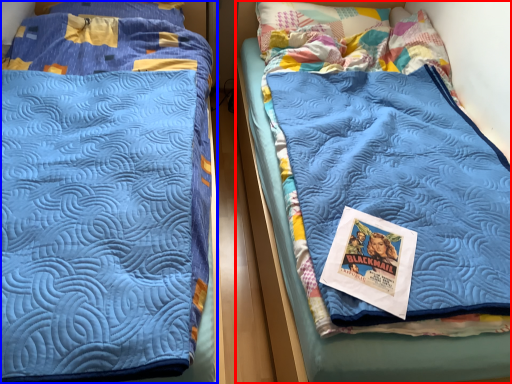
Question: Which object is further to the camera taking this photo, bed (highlighted by a red box) or bed (highlighted by a blue box)?

Choices:
 (A) bed
 (B) bed

Answer: (A)